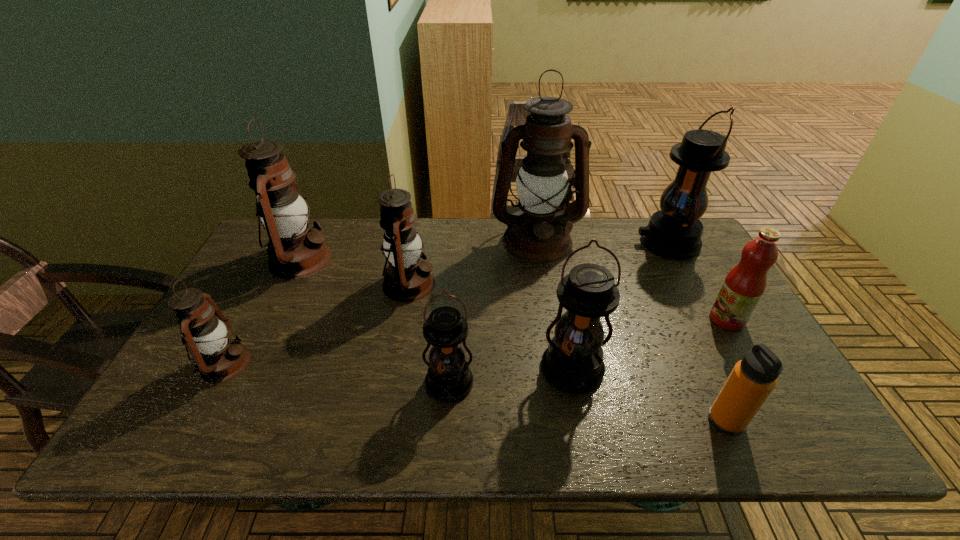
Locate several spots in free space located above the second smallest black lantern, indicating its light source. Please provide its 2D coordinates. Your answer should be formatted as a tuple, i.e. [(x, y)], where the tuple contains the x and y coordinates of a point satisfying the conditions above.

[(586, 436)]

Where is `free space located 0.370m on the front label of the pink fruit juice`? The image size is (960, 540). free space located 0.370m on the front label of the pink fruit juice is located at coordinates (x=574, y=319).

This screenshot has height=540, width=960. I want to click on free point located 0.130m on the front label of the pink fruit juice, so click(662, 319).

Locate an element on the screen. This screenshot has width=960, height=540. vacant area situated 0.350m on the front label of the pink fruit juice is located at coordinates (582, 319).

Find the location of `vacant space positioned on the side of the nearest brown lantern, there is a wick adjustment knob`. vacant space positioned on the side of the nearest brown lantern, there is a wick adjustment knob is located at coordinates (363, 363).

Can you point to a free location located 0.090m above the fourth lantern from right to left, indicating its light source? Please provide its 2D coordinates. Your answer should be formatted as a tuple, i.e. [(x, y)], where the tuple contains the x and y coordinates of a point satisfying the conditions above.

[(445, 444)]

You are a GUI agent. You are given a task and a screenshot of the screen. Output one action in this format:
    pyautogui.click(x=<x>, y=<y>)
    Task: Click on the free space located on the back of the thermos bottle
    
    Given the screenshot: What is the action you would take?
    pyautogui.click(x=685, y=333)

Locate an element on the screen. This screenshot has height=540, width=960. object that is at the near edge is located at coordinates (753, 378).

Locate an element on the screen. This screenshot has width=960, height=540. lantern located at the right edge is located at coordinates (674, 232).

Identify the location of fruit juice at the right edge. (743, 287).